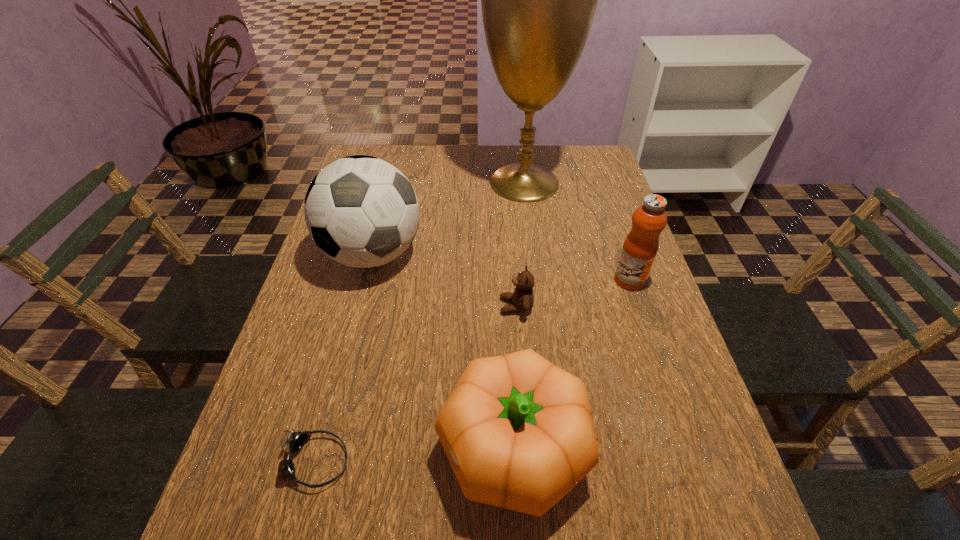
I want to click on vacant space that is in between the soccer ball and the pumpkin, so click(x=443, y=352).

Locate an element on the screen. unoccupied area between the rightmost object and the teddy bear is located at coordinates (573, 293).

This screenshot has height=540, width=960. I want to click on vacant space that is in between the soccer ball and the teddy bear, so click(444, 280).

I want to click on free point between the farthest object and the goggles, so click(x=420, y=322).

At what (x,y) coordinates should I click in order to perform the action: click on free space between the pumpkin and the tallest object. Please return your answer as a coordinate pair (x, y). Looking at the image, I should click on (517, 315).

At what (x,y) coordinates should I click in order to perform the action: click on vacant area that lies between the farthest object and the goggles. Please return your answer as a coordinate pair (x, y). The width and height of the screenshot is (960, 540). Looking at the image, I should click on click(420, 322).

Where is `vacant area that lies between the fourth tallest object and the soccer ball`? vacant area that lies between the fourth tallest object and the soccer ball is located at coordinates (443, 352).

Select which object is the third closest to the teddy bear. Please provide its 2D coordinates. Your answer should be formatted as a tuple, i.e. [(x, y)], where the tuple contains the x and y coordinates of a point satisfying the conditions above.

[(640, 247)]

Locate which object is the second closest to the fourth tallest object. Please provide its 2D coordinates. Your answer should be formatted as a tuple, i.e. [(x, y)], where the tuple contains the x and y coordinates of a point satisfying the conditions above.

[(522, 299)]

Locate an element on the screen. free spot that satisfies the following two spatial constraints: 1. on the front label of the rightmost object; 2. at the face of the second shortest object is located at coordinates (638, 306).